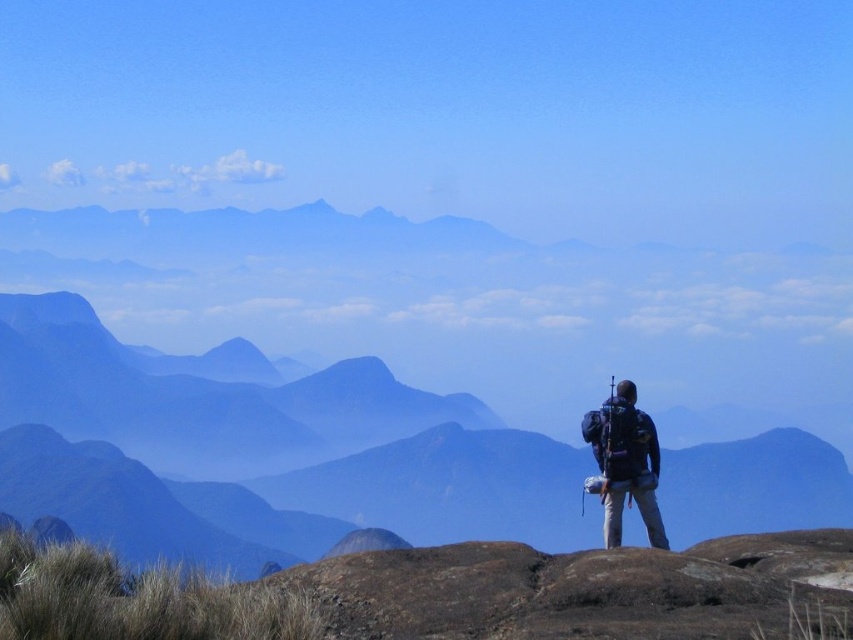
Does smooth rock mountain at center appear on the right side of dark blue fabric backpack at right?

Indeed, smooth rock mountain at center is positioned on the right side of dark blue fabric backpack at right.

The image size is (853, 640). What do you see at coordinates (292, 436) in the screenshot?
I see `smooth rock mountain at center` at bounding box center [292, 436].

Is point (155, 404) farther from viewer compared to point (634, 436)?

Yes, it is behind point (634, 436).

Locate an element on the screen. This screenshot has height=640, width=853. smooth rock mountain at center is located at coordinates (292, 436).